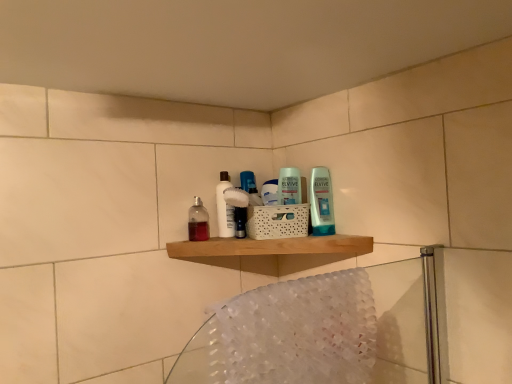
At what (x,y) coordinates should I click in order to perform the action: click on vacant region to the right of translucent plastic bottle at center. Please return your answer as a coordinate pair (x, y). Looking at the image, I should click on (238, 238).